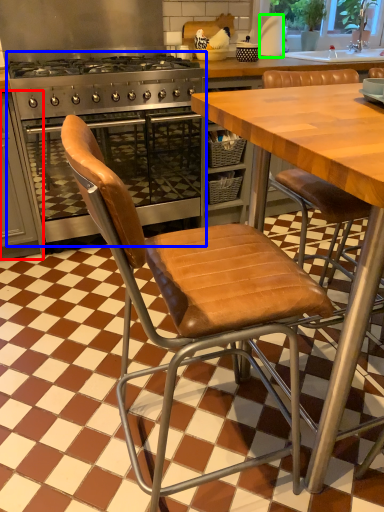
Question: Which object is positioned closest to cabinetry (highlighted by a red box)? Select from kitchen appliance (highlighted by a blue box) and paper towel (highlighted by a green box).

Choices:
 (A) kitchen appliance
 (B) paper towel

Answer: (A)